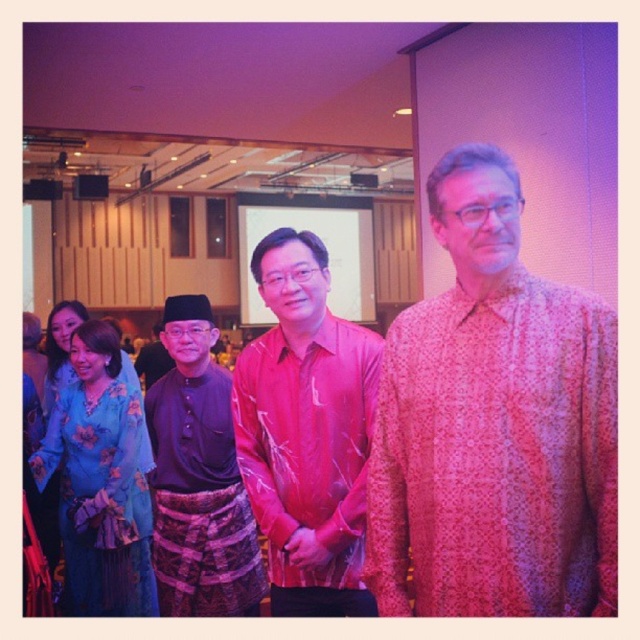
Question: Does pink printed shirt at center have a lesser width compared to blue floral dress at lower left?

Choices:
 (A) no
 (B) yes

Answer: (B)

Question: Is pink floral shirt at center behind blue floral dress at lower left?

Choices:
 (A) no
 (B) yes

Answer: (A)

Question: Among these objects, which one is farthest from the camera?

Choices:
 (A) pink printed shirt at center
 (B) dark brown batik at left

Answer: (B)

Question: Which object is positioned closest to the dark brown batik at left?

Choices:
 (A) pink floral shirt at center
 (B) pink printed shirt at center
 (C) blue floral dress at lower left

Answer: (C)

Question: Is pink printed shirt at center behind dark brown batik at left?

Choices:
 (A) yes
 (B) no

Answer: (B)

Question: Which point appears closest to the camera in this image?

Choices:
 (A) (83, 554)
 (B) (243, 592)
 (C) (371, 600)

Answer: (C)